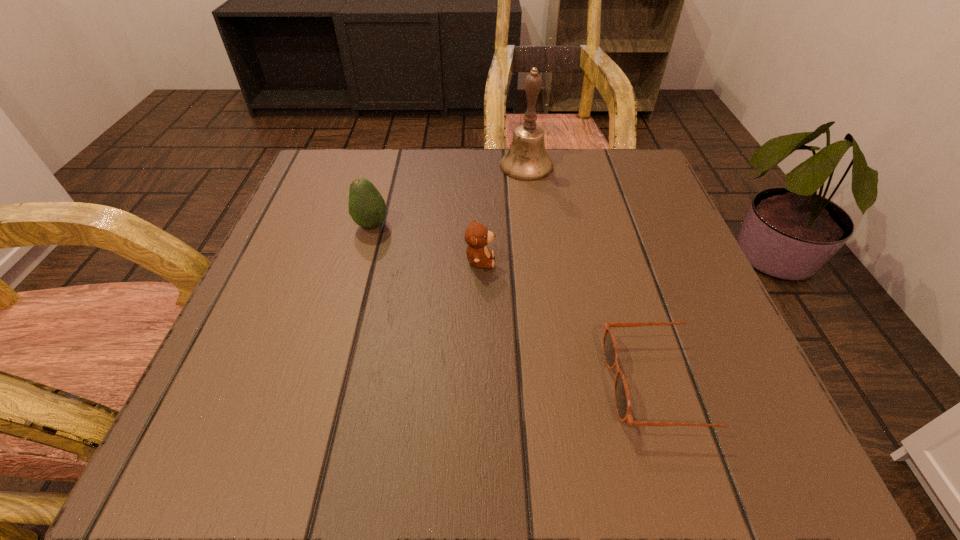
Identify the location of free space between the second farthest object and the teddy bear. (425, 243).

Where is `free space between the sunglasses and the third shortest object`? free space between the sunglasses and the third shortest object is located at coordinates 518,305.

The height and width of the screenshot is (540, 960). What are the coordinates of `free area in between the third tallest object and the shortest object` in the screenshot? It's located at (573, 322).

You are a GUI agent. You are given a task and a screenshot of the screen. Output one action in this format:
    pyautogui.click(x=<x>, y=<y>)
    Task: Click on the free spot between the third farthest object and the nearest object
    This screenshot has width=960, height=540.
    Given the screenshot: What is the action you would take?
    pyautogui.click(x=573, y=322)

What are the coordinates of `free space between the third object from left to right and the shortest object` in the screenshot? It's located at 596,275.

Find the location of `vacant space that's between the rightmost object and the second object from left to right`. vacant space that's between the rightmost object and the second object from left to right is located at coordinates (573, 322).

Choose which object is the third nearest neighbor to the farthest object. Please provide its 2D coordinates. Your answer should be formatted as a tuple, i.e. [(x, y)], where the tuple contains the x and y coordinates of a point satisfying the conditions above.

[(623, 406)]

Select which object appears as the second closest to the leftmost object. Please provide its 2D coordinates. Your answer should be formatted as a tuple, i.e. [(x, y)], where the tuple contains the x and y coordinates of a point satisfying the conditions above.

[(527, 160)]

You are a GUI agent. You are given a task and a screenshot of the screen. Output one action in this format:
    pyautogui.click(x=<x>, y=<y>)
    Task: Click on the vacant space that satisfies the following two spatial constraints: 1. on the back side of the third nearest object; 2. on the right side of the tallest object
    The height and width of the screenshot is (540, 960).
    Given the screenshot: What is the action you would take?
    click(387, 166)